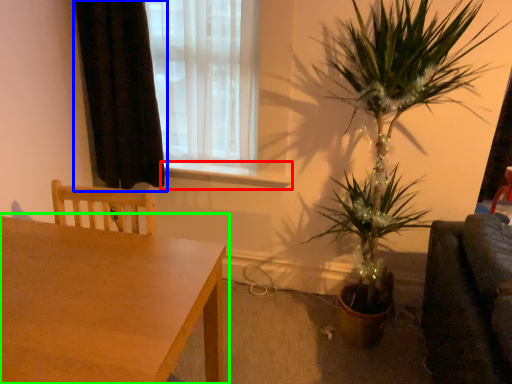
Question: Which object is the farthest from window sill (highlighted by a red box)? Choose among these: curtain (highlighted by a blue box) or table (highlighted by a green box).

Choices:
 (A) curtain
 (B) table

Answer: (B)